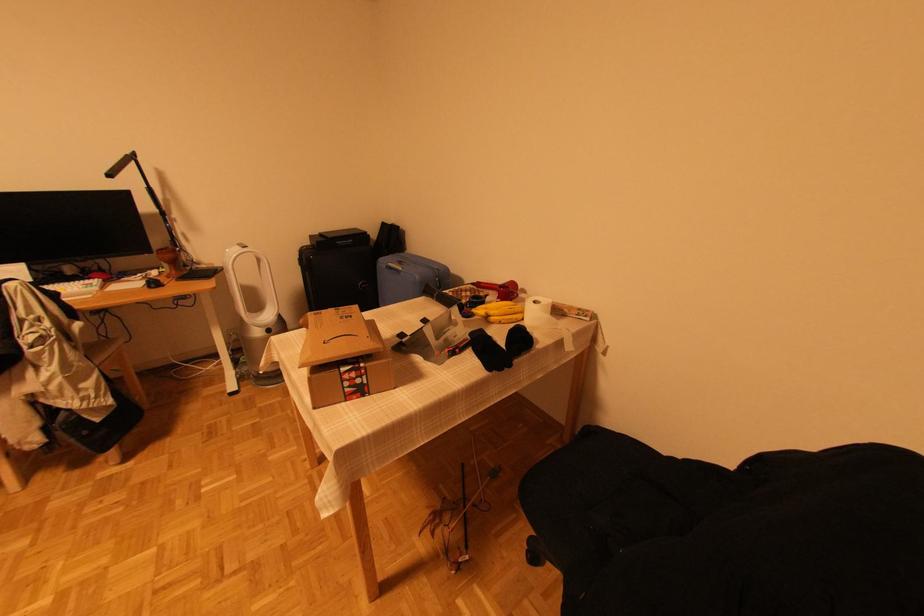
Image resolution: width=924 pixels, height=616 pixels. Find the location of `Amazon cardboard box`. Amazon cardboard box is located at coordinates (343, 357).